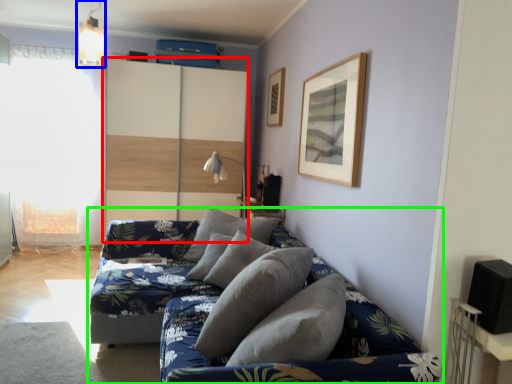
Question: Estimate the real-world distances between objects in this image. Which object is closer to dresser (highlighted by a red box), light fixture (highlighted by a blue box) or studio couch (highlighted by a green box)?

Choices:
 (A) light fixture
 (B) studio couch

Answer: (A)